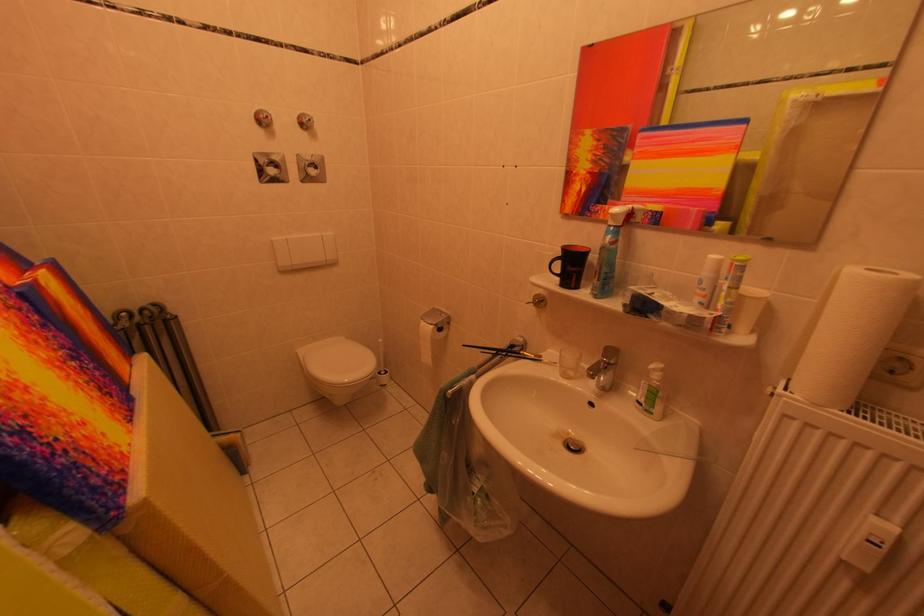
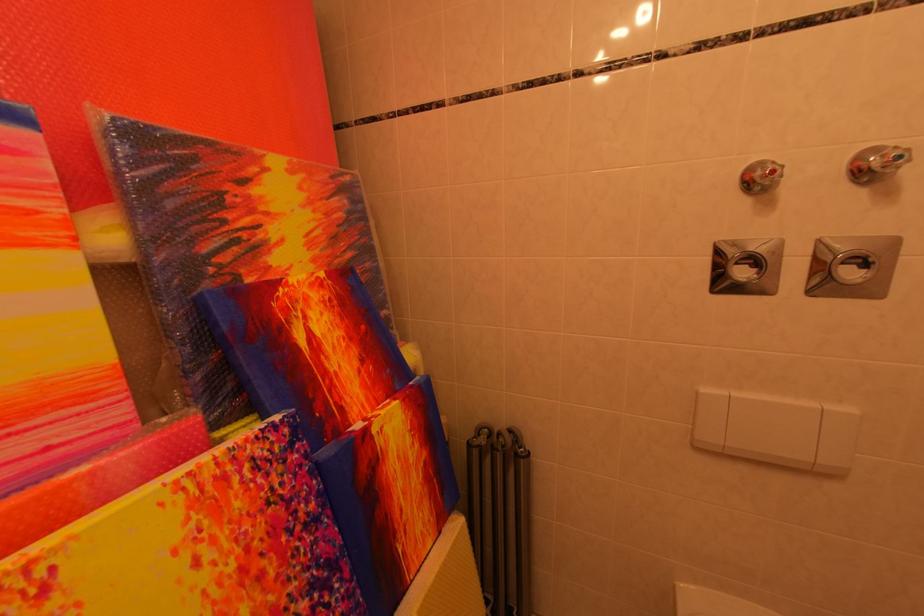
Where in the second image is the point corresponding to the point at 282,175 from the first image?

(751, 277)